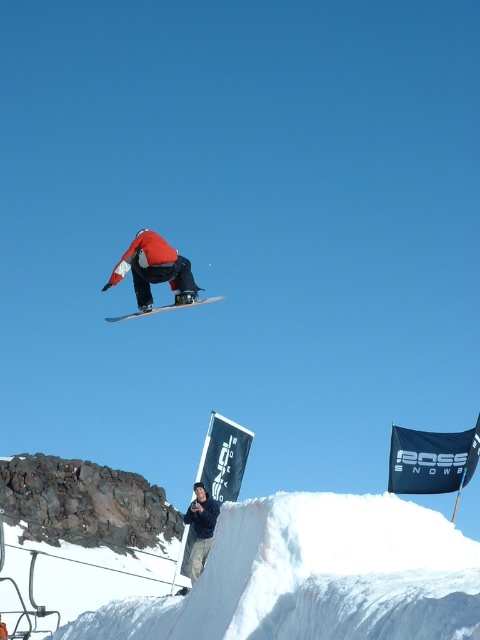
Question: Which of the following is the farthest from the observer?

Choices:
 (A) matte red snowboarder at center
 (B) white matte snowboard at center

Answer: (A)

Question: Can you confirm if matte red snowboarder at center is thinner than white matte snowboard at center?

Choices:
 (A) yes
 (B) no

Answer: (A)

Question: Is matte red snowboarder at center below white matte snowboard at center?

Choices:
 (A) no
 (B) yes

Answer: (A)

Question: Does matte red snowboarder at center have a greater width compared to white matte snowboard at center?

Choices:
 (A) yes
 (B) no

Answer: (B)